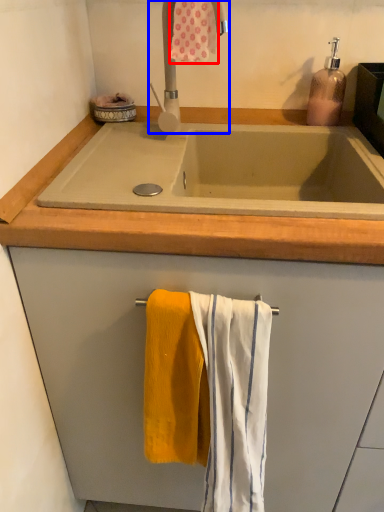
Question: Among these objects, which one is nearest to the camera, bath towel (highlighted by a red box) or tap (highlighted by a blue box)?

Choices:
 (A) bath towel
 (B) tap

Answer: (B)